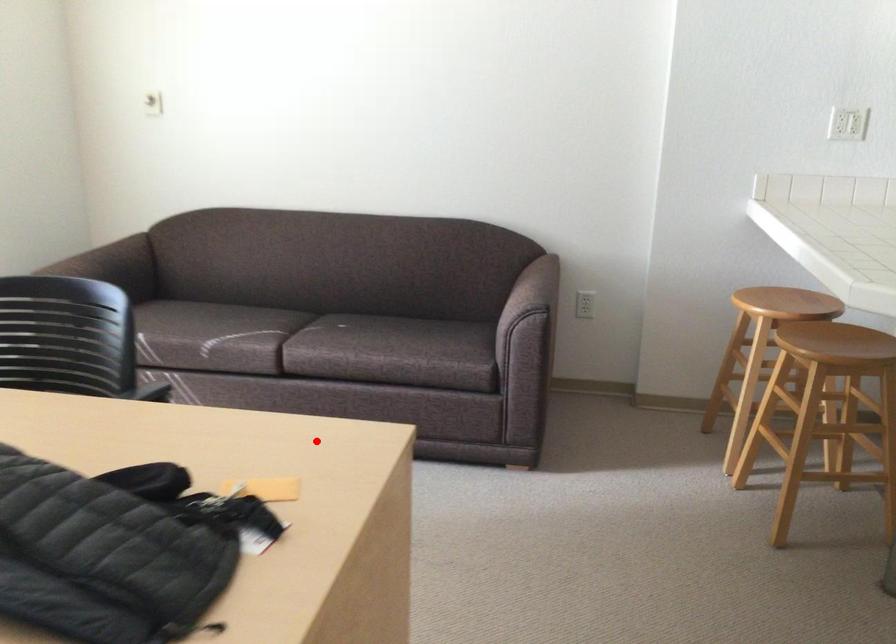
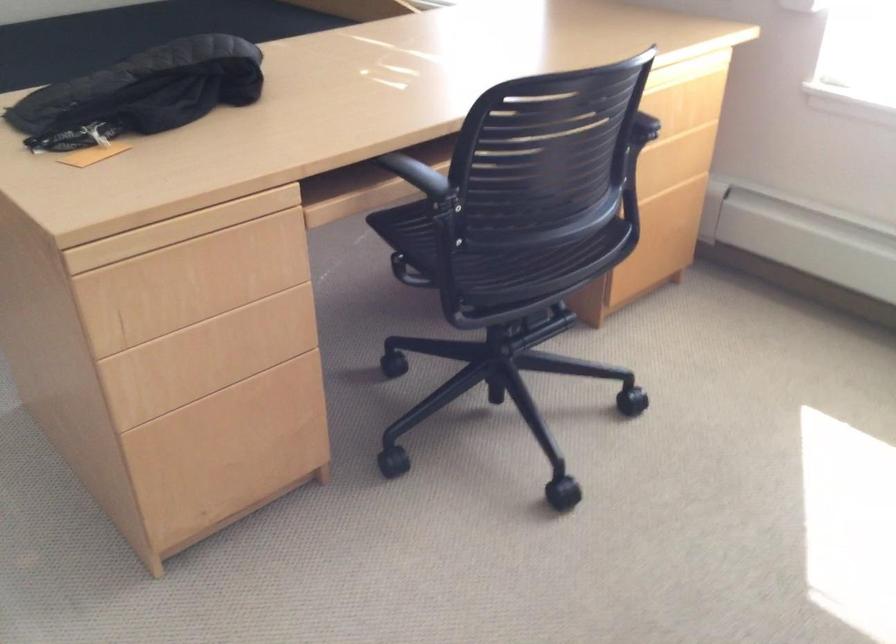
Where in the second image is the point corresponding to the highlighted location from the first image?

(179, 229)